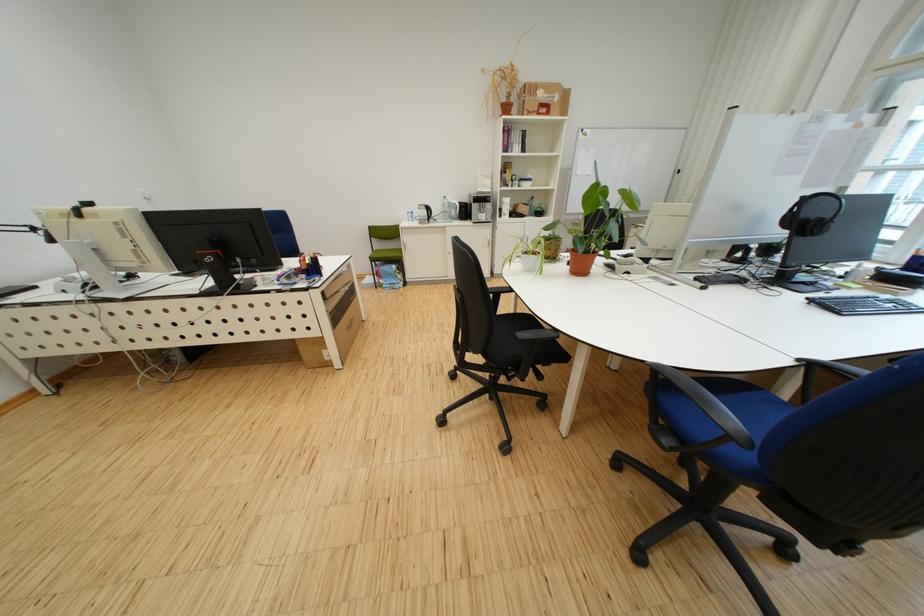
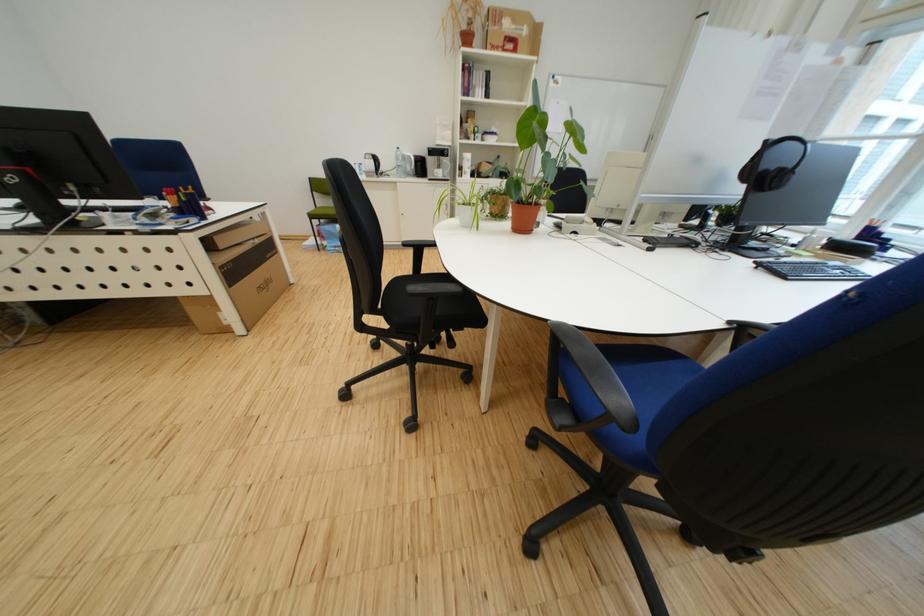
Locate, in the second image, the point that corresponds to the point at 821,196 in the first image.

(786, 140)